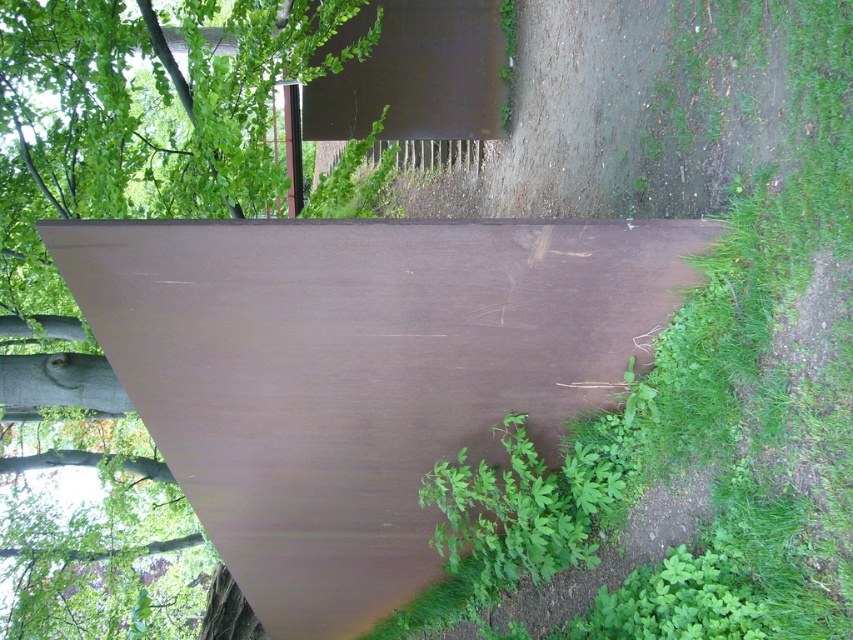
You are standing at the origin point of the coordinate system in this scene. You need to locate the brown matte board at center. What are its coordinates?

The brown matte board at center is located at coordinates point (358, 372).

You are an architect designing a new outdoor installation. You have two materials to choose from for your project. The first is the brown matte board at center, and the second is the green matte tree at upper left. If you want to use a material that is thinner, which one should you choose?

The brown matte board at center is thinner than the green matte tree at upper left, so you should choose the brown matte board at center for a thinner material.